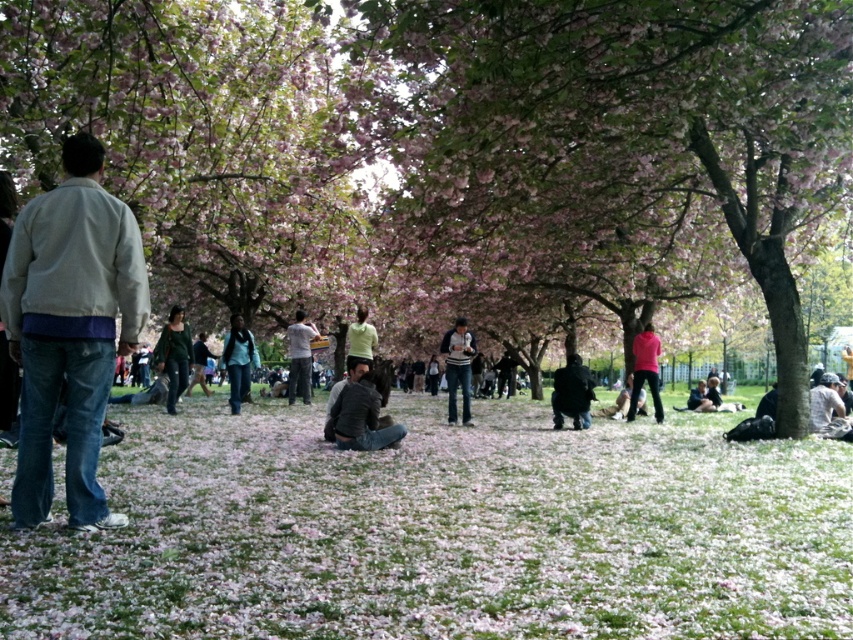
Is point (100, 557) farther from camera compared to point (241, 355)?

That is False.

From the picture: Does pink matte flower at center have a larger size compared to denim jacket at center?

Correct, pink matte flower at center is larger in size than denim jacket at center.

This screenshot has width=853, height=640. Find the location of `pink matte flower at center`. pink matte flower at center is located at coordinates (444, 531).

Can you confirm if light gray denim jacket at left is wider than camouflage fabric jacket at lower right?

No.

The image size is (853, 640). Identify the location of light gray denim jacket at left. (70, 328).

This screenshot has width=853, height=640. What are the coordinates of `light gray denim jacket at left` in the screenshot? It's located at (70, 328).

Is dark gray fabric jacket at center thinner than camouflage fabric jacket at lower right?

Indeed, dark gray fabric jacket at center has a lesser width compared to camouflage fabric jacket at lower right.

The width and height of the screenshot is (853, 640). In order to click on dark gray fabric jacket at center in this screenshot , I will do `click(363, 416)`.